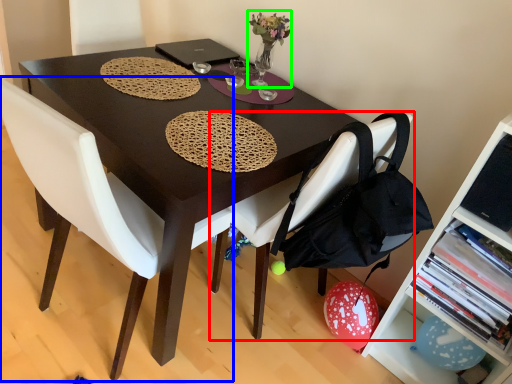
Question: Based on their relative distances, which object is farther from chair (highlighted by a red box)? Choose from chair (highlighted by a blue box) and floral arrangement (highlighted by a green box).

Choices:
 (A) chair
 (B) floral arrangement

Answer: (B)